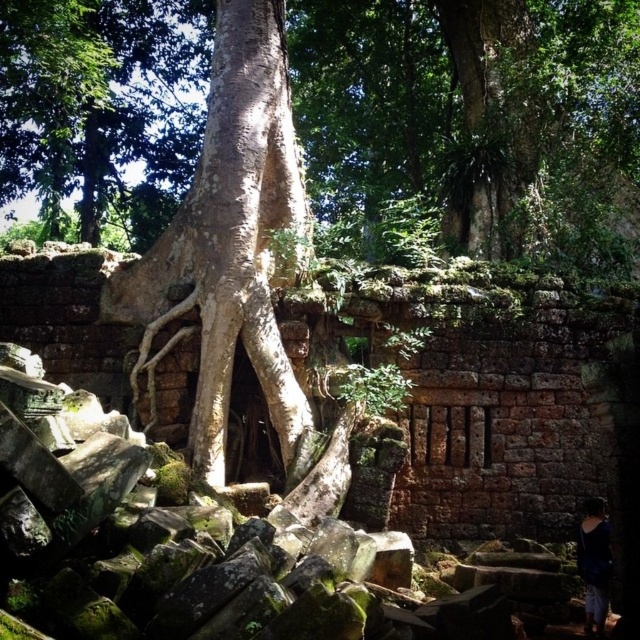
You are an archaeologist examining the ancient ruins. You notice the smooth bark tree at center and the dark blue fabric at lower right. Which object is positioned higher in the scene?

The smooth bark tree at center is located above dark blue fabric at lower right, so it is positioned higher in the scene.

You are an archaeologist examining the ancient ruins. You notice the white rough tree trunk at center and the dark blue fabric at lower right. Which object is closer to your current position?

The white rough tree trunk at center is closer to you than the dark blue fabric at lower right, so the white rough tree trunk at center is closer.

You are an archaeologist examining the ancient ruins and notice the smooth bark tree at center and the dark blue fabric at lower right. Which object is taller?

The smooth bark tree at center is taller than the dark blue fabric at lower right.